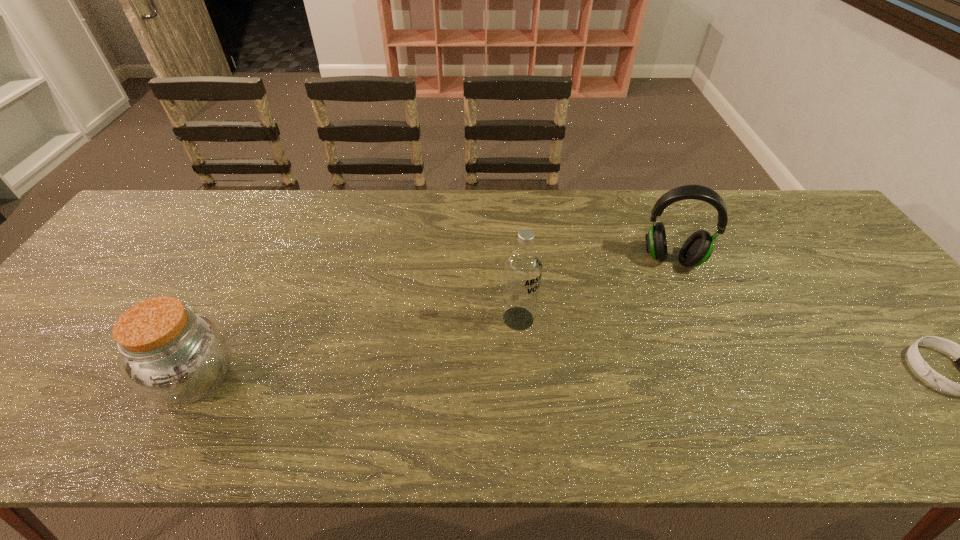
Locate an element on the screen. The width and height of the screenshot is (960, 540). vacant space on the desktop that is between the leftmost object and the shortest object and is positioned on the front label of the third object from right to left is located at coordinates (583, 374).

Locate an element on the screen. free space on the desktop that is between the jar and the shortest object and is positioned on the ear cups of the farthest object is located at coordinates (670, 373).